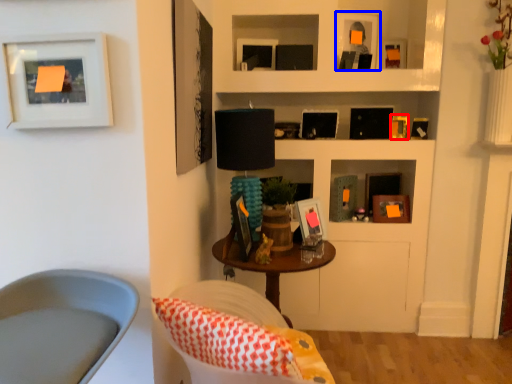
Question: Which object appears farthest to the camera in this image, picture frame (highlighted by a red box) or picture frame (highlighted by a blue box)?

Choices:
 (A) picture frame
 (B) picture frame

Answer: (A)